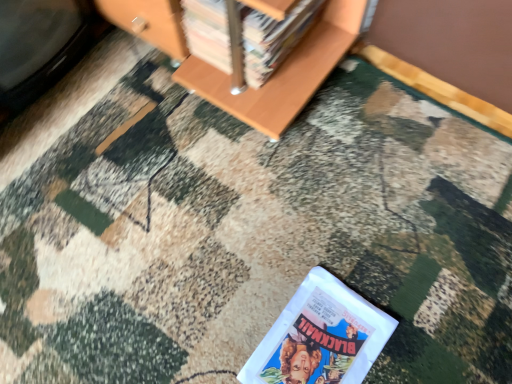
Question: From a real-world perspective, is wooden bookshelf at upper center, the first book when ordered from top to bottom, positioned above or below white glossy book at lower center, the 2th book in the top-to-bottom sequence?

Choices:
 (A) above
 (B) below

Answer: (A)

Question: Considering their positions, is wooden bookshelf at upper center, positioned as the second book in bottom-to-top order, located in front of or behind white glossy book at lower center, the first book positioned from the bottom?

Choices:
 (A) behind
 (B) front

Answer: (A)

Question: Would you say wooden bookshelf at upper center, positioned as the second book in bottom-to-top order, is inside or outside white glossy book at lower center, the first book positioned from the bottom?

Choices:
 (A) inside
 (B) outside

Answer: (B)

Question: Considering the relative positions of white glossy book at lower center, the first book positioned from the bottom, and wooden bookshelf at upper center, the first book when ordered from top to bottom, in the image provided, is white glossy book at lower center, the first book positioned from the bottom, to the left or to the right of wooden bookshelf at upper center, the first book when ordered from top to bottom,?

Choices:
 (A) right
 (B) left

Answer: (A)

Question: In terms of height, does white glossy book at lower center, the 2th book in the top-to-bottom sequence, look taller or shorter compared to wooden bookshelf at upper center, positioned as the second book in bottom-to-top order?

Choices:
 (A) short
 (B) tall

Answer: (A)

Question: Considering the positions of white glossy book at lower center, the first book positioned from the bottom, and wooden bookshelf at upper center, positioned as the second book in bottom-to-top order, in the image, is white glossy book at lower center, the first book positioned from the bottom, bigger or smaller than wooden bookshelf at upper center, positioned as the second book in bottom-to-top order,?

Choices:
 (A) big
 (B) small

Answer: (B)

Question: Is white glossy book at lower center, the 2th book in the top-to-bottom sequence, spatially inside wooden bookshelf at upper center, the first book when ordered from top to bottom, or outside of it?

Choices:
 (A) inside
 (B) outside

Answer: (B)